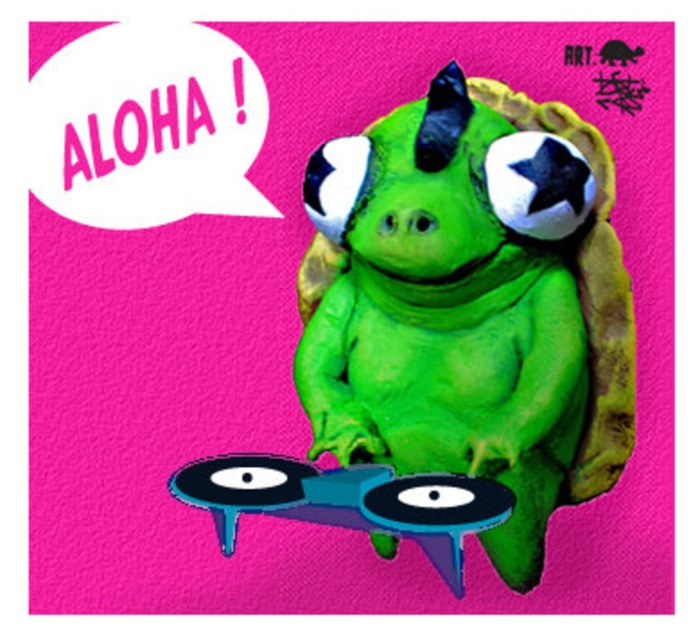
What are the coordinates of the green rubber turtle at center?

The green rubber turtle at center is located at coordinates point (470, 307).

You are a DJ at a party and need to place a new record on the turntable. The turntable has a diameter of 12 inches. Can the blue rubber record at center fit on the green rubber turtle at center?

The distance between the green rubber turtle at center and blue rubber record at center is 8.74 inches. Since the turntable has a diameter of 12 inches, the blue rubber record at center can fit on the green rubber turtle at center as long as its size does not exceed the turntable.